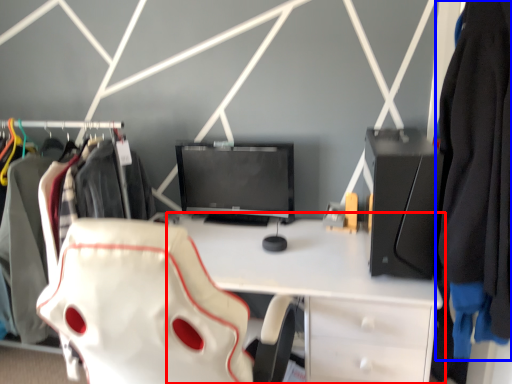
Question: Which object is closer to the camera taking this photo, desk (highlighted by a red box) or clothing (highlighted by a blue box)?

Choices:
 (A) desk
 (B) clothing

Answer: (B)